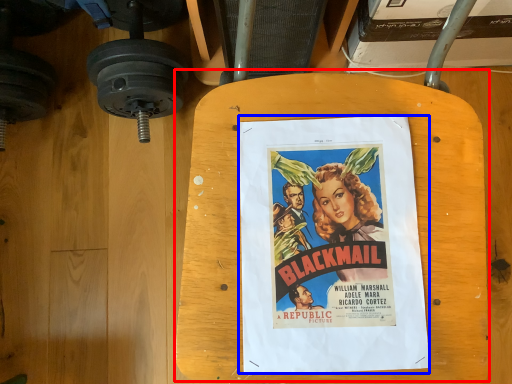
Question: Among these objects, which one is farthest to the camera, table (highlighted by a red box) or poster (highlighted by a blue box)?

Choices:
 (A) table
 (B) poster

Answer: (B)